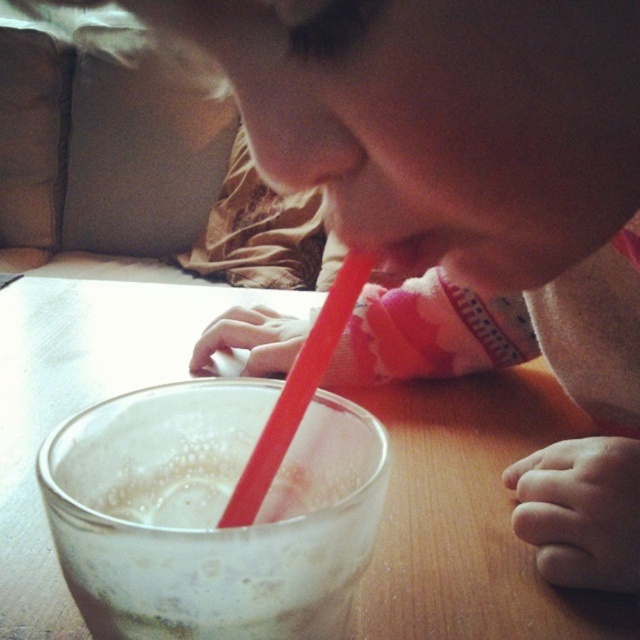
Question: Does transparent glass table at center appear over rubberized red straw at center?

Choices:
 (A) no
 (B) yes

Answer: (A)

Question: Is transparent glass table at center closer to the viewer compared to white frothy liquid at center?

Choices:
 (A) yes
 (B) no

Answer: (B)

Question: Which object is closer to the camera taking this photo?

Choices:
 (A) transparent glass table at center
 (B) rubberized red straw at center
 (C) white frothy liquid at center

Answer: (C)

Question: Which point appears closest to the camera in this image?

Choices:
 (A) (230, 525)
 (B) (369, 596)
 (C) (317, 529)

Answer: (C)

Question: Considering the relative positions of transparent glass table at center and white frothy liquid at center in the image provided, where is transparent glass table at center located with respect to white frothy liquid at center?

Choices:
 (A) below
 (B) above

Answer: (B)

Question: Which point is farther to the camera?

Choices:
 (A) white frothy liquid at center
 (B) rubberized red straw at center
 (C) transparent glass table at center

Answer: (C)